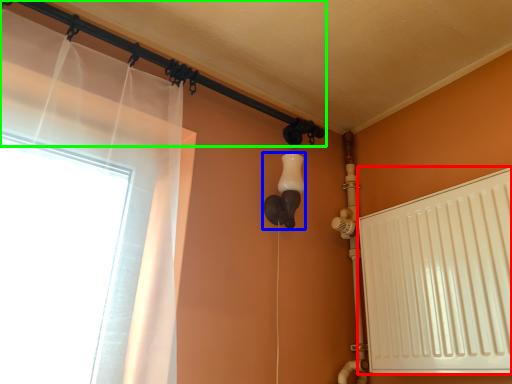
Question: Based on their relative distances, which object is farther from radiator (highlighted by a red box)? Choose from light fixture (highlighted by a blue box) and pipe (highlighted by a green box).

Choices:
 (A) light fixture
 (B) pipe

Answer: (B)